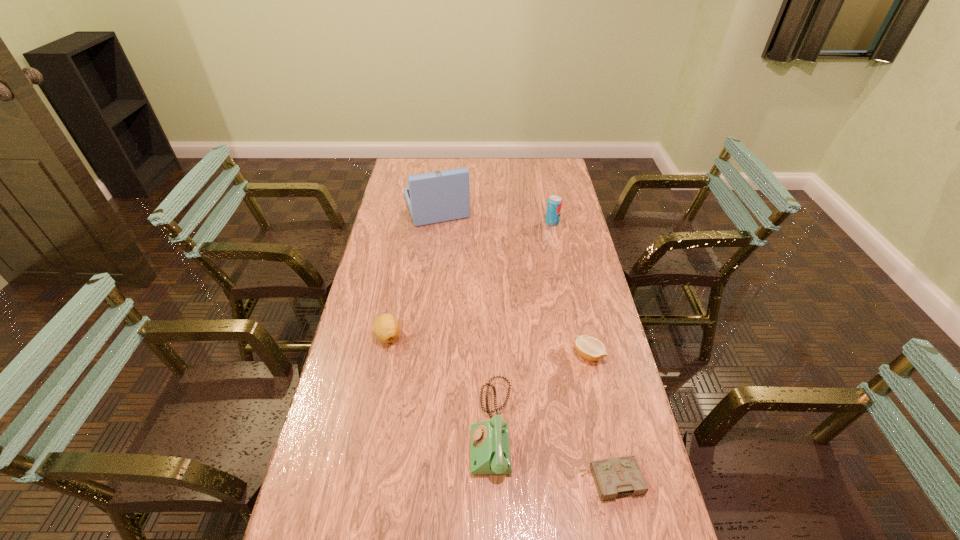
The height and width of the screenshot is (540, 960). In order to click on the tallest object in this screenshot , I will do `click(440, 196)`.

Identify the location of soda can. (554, 204).

Locate an element on the screen. This screenshot has width=960, height=540. telephone is located at coordinates (490, 453).

Image resolution: width=960 pixels, height=540 pixels. Find the location of `the left lemon`. the left lemon is located at coordinates (386, 327).

Identify the location of the fifth tallest object. This screenshot has width=960, height=540. coord(590,348).

At what (x,y) coordinates should I click in order to perform the action: click on the shorter lemon. Please return your answer as a coordinate pair (x, y). This screenshot has height=540, width=960. Looking at the image, I should click on (590, 348).

The image size is (960, 540). I want to click on the shortest object, so click(x=619, y=476).

The height and width of the screenshot is (540, 960). Identify the location of vacant area situated on the front of the tallest object. (426, 285).

In order to click on free space located 0.090m on the back of the second tallest object in this screenshot , I will do `click(549, 206)`.

Identify the location of vacant space located 0.390m on the dial of the third object from left to right. (324, 428).